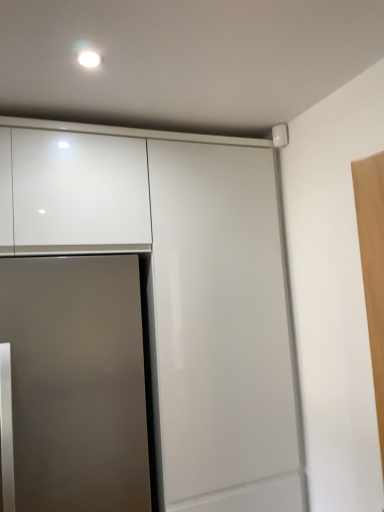
Describe the element at coordinates (76, 382) in the screenshot. I see `satin silver door at lower left` at that location.

The height and width of the screenshot is (512, 384). In order to click on satin silver door at lower left in this screenshot , I will do pyautogui.click(x=76, y=382).

Measure the distance between satin silver door at lower left and camera.

4.58 feet.

This screenshot has height=512, width=384. What are the coordinates of `glossy white cabinet at upper center` in the screenshot? It's located at (181, 289).

What do you see at coordinates (181, 289) in the screenshot?
I see `glossy white cabinet at upper center` at bounding box center [181, 289].

Locate an element on the screen. This screenshot has width=384, height=512. satin silver door at lower left is located at coordinates (76, 382).

Looking at this image, is glossy white cabinet at upper center at the left side of satin silver door at lower left?

No, glossy white cabinet at upper center is not to the left of satin silver door at lower left.

Consider the image. Does glossy white cabinet at upper center come behind satin silver door at lower left?

Yes, glossy white cabinet at upper center is behind satin silver door at lower left.

Considering the positions of point (120, 129) and point (102, 497), is point (120, 129) closer or farther from the camera than point (102, 497)?

Point (120, 129) is farther from the camera than point (102, 497).

From the image's perspective, between glossy white cabinet at upper center and satin silver door at lower left, who is located below?

satin silver door at lower left is shown below in the image.

From a real-world perspective, relative to satin silver door at lower left, is glossy white cabinet at upper center vertically above or below?

Clearly, from a real-world perspective, glossy white cabinet at upper center is above satin silver door at lower left.

Consider the image. Considering the sizes of objects glossy white cabinet at upper center and satin silver door at lower left in the image provided, who is thinner, glossy white cabinet at upper center or satin silver door at lower left?

glossy white cabinet at upper center is thinner.

Does glossy white cabinet at upper center have a lesser height compared to satin silver door at lower left?

In fact, glossy white cabinet at upper center may be taller than satin silver door at lower left.

Consider the image. Who is bigger, glossy white cabinet at upper center or satin silver door at lower left?

Bigger between the two is glossy white cabinet at upper center.

Is satin silver door at lower left inside glossy white cabinet at upper center?

Yes, satin silver door at lower left is inside glossy white cabinet at upper center.

Is glossy white cabinet at upper center placed right next to satin silver door at lower left?

They are not placed beside each other.

Is glossy white cabinet at upper center oriented towards satin silver door at lower left?

Yes, glossy white cabinet at upper center is turned towards satin silver door at lower left.

What are the coordinates of `cabinetry above the satin silver door at lower left (from a real-world perspective)` in the screenshot? It's located at (181, 289).

Does satin silver door at lower left appear on the left side of glossy white cabinet at upper center?

Indeed, satin silver door at lower left is positioned on the left side of glossy white cabinet at upper center.

Considering the positions of objects satin silver door at lower left and glossy white cabinet at upper center in the image provided, who is behind, satin silver door at lower left or glossy white cabinet at upper center?

Positioned behind is glossy white cabinet at upper center.

Is point (43, 433) positioned in front of point (157, 331)?

Yes.

From the image's perspective, between satin silver door at lower left and glossy white cabinet at upper center, who is located below?

satin silver door at lower left.

From a real-world perspective, between satin silver door at lower left and glossy white cabinet at upper center, who is vertically lower?

From a 3D spatial view, satin silver door at lower left is below.

Between satin silver door at lower left and glossy white cabinet at upper center, which one has smaller width?

Thinner between the two is glossy white cabinet at upper center.

Based on the photo, considering the sizes of satin silver door at lower left and glossy white cabinet at upper center in the image, is satin silver door at lower left taller or shorter than glossy white cabinet at upper center?

Clearly, satin silver door at lower left is shorter compared to glossy white cabinet at upper center.

Considering the sizes of objects satin silver door at lower left and glossy white cabinet at upper center in the image provided, who is smaller, satin silver door at lower left or glossy white cabinet at upper center?

Smaller between the two is satin silver door at lower left.

Is satin silver door at lower left not inside glossy white cabinet at upper center?

No, satin silver door at lower left is inside or overlapping with glossy white cabinet at upper center.

Would you say satin silver door at lower left is a long distance from glossy white cabinet at upper center?

They are positioned close to each other.

Is glossy white cabinet at upper center at the back of satin silver door at lower left?

Correct, satin silver door at lower left is looking away from glossy white cabinet at upper center.

What's the angular difference between satin silver door at lower left and glossy white cabinet at upper center's facing directions?

The angle between the facing direction of satin silver door at lower left and the facing direction of glossy white cabinet at upper center is 0.909 degrees.

The height and width of the screenshot is (512, 384). Identify the location of cabinetry positioned vertically above the satin silver door at lower left (from a real-world perspective). (181, 289).

Find the location of a particular element. This screenshot has width=384, height=512. door lying in front of the glossy white cabinet at upper center is located at coordinates click(76, 382).

At what (x,y) coordinates should I click in order to perform the action: click on cabinetry on the right of satin silver door at lower left. Please return your answer as a coordinate pair (x, y). The width and height of the screenshot is (384, 512). Looking at the image, I should click on (181, 289).